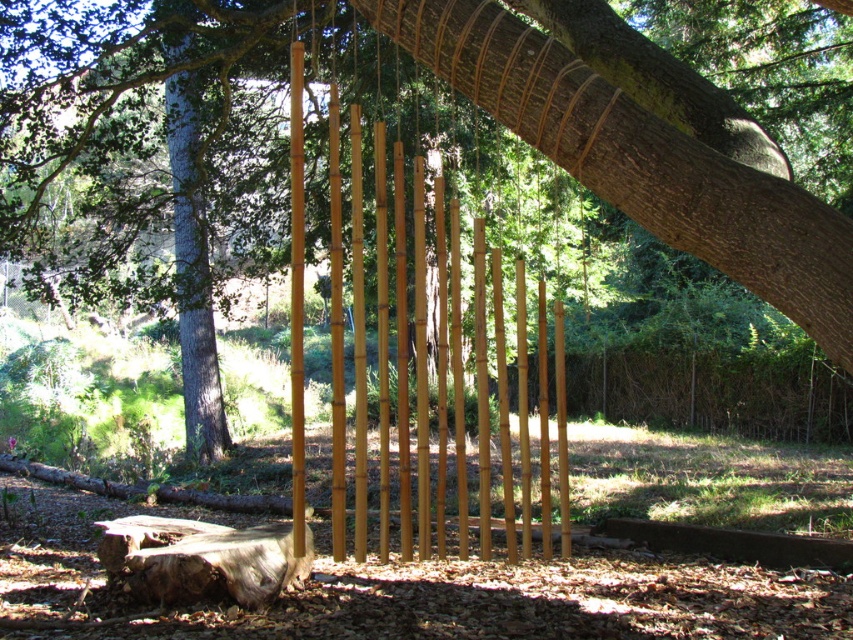
Question: Can you confirm if natural bamboo wind chime at center is positioned to the left of brown wooden fence at center?

Choices:
 (A) no
 (B) yes

Answer: (B)

Question: Does brown wooden fence at center appear under smooth gray bark at center?

Choices:
 (A) yes
 (B) no

Answer: (A)

Question: Which object appears closest to the camera in this image?

Choices:
 (A) natural bamboo wind chime at center
 (B) brown wooden fence at center

Answer: (A)

Question: Which object appears farthest from the camera in this image?

Choices:
 (A) smooth gray bark at center
 (B) brown wooden fence at center

Answer: (B)

Question: Which of the following is the closest to the observer?

Choices:
 (A) (712, 385)
 (B) (173, 252)
 (C) (480, 93)

Answer: (C)

Question: Is natural bamboo wind chime at center positioned behind smooth gray bark at center?

Choices:
 (A) no
 (B) yes

Answer: (A)